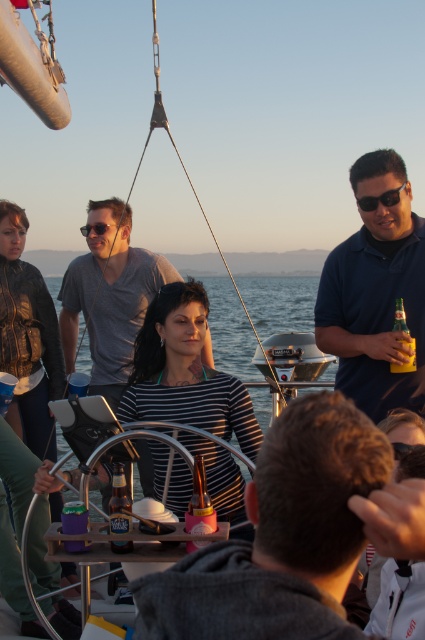
You are a photographer on the sailboat and want to capture both the black plastic sunglasses at right and the matte black sunglasses at upper left in a single shot. Which sunglasses are positioned to the right side of the frame?

The black plastic sunglasses at right are positioned to the right of the matte black sunglasses at upper left, so they are on the right side of the frame.

You are a photographer on the deck of the sailboat. You need to capture a photo that includes both the matte black shirt at center and the matte gray shirt at center. Which of the two shirts will appear smaller in the final photo?

The matte black shirt at center occupies less space than the matte gray shirt at center, so it will appear smaller in the photo.